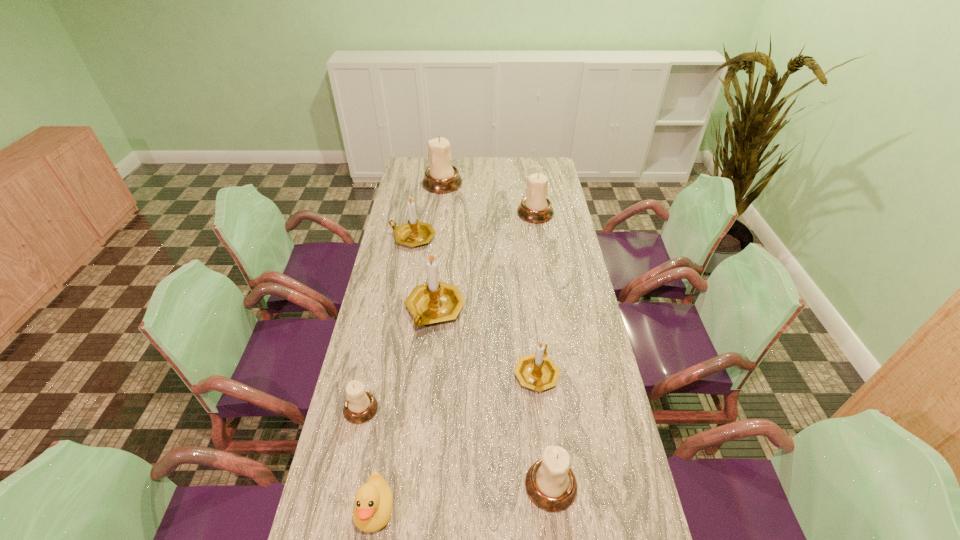
Locate an element on the screen. This screenshot has height=540, width=960. free space between the farthest gold candle holder and the shortest candle holder is located at coordinates (387, 323).

The image size is (960, 540). In order to click on empty space that is in between the fourth farthest object and the third nearest white candle holder in this screenshot , I will do `click(485, 261)`.

Locate an element on the screen. This screenshot has width=960, height=540. vacant space that is in between the third farthest white candle holder and the duck is located at coordinates (368, 458).

Locate an element on the screen. free spot between the duck and the seventh nearest object is located at coordinates (455, 361).

Identify which object is the third closest to the second nearest white candle holder. Please provide its 2D coordinates. Your answer should be formatted as a tuple, i.e. [(x, y)], where the tuple contains the x and y coordinates of a point satisfying the conditions above.

[(537, 371)]

Identify which object is located as the seventh nearest to the second biggest white candle holder. Please provide its 2D coordinates. Your answer should be formatted as a tuple, i.e. [(x, y)], where the tuple contains the x and y coordinates of a point satisfying the conditions above.

[(373, 502)]

Locate an element on the screen. This screenshot has height=540, width=960. candle holder that is the fourth closest one to the smallest gold candle holder is located at coordinates (414, 233).

Where is `the second closest candle holder to the shortest candle holder`? The image size is (960, 540). the second closest candle holder to the shortest candle holder is located at coordinates (537, 371).

The height and width of the screenshot is (540, 960). What are the coordinates of `white candle holder that is the second nearest to the sixth nearest candle holder` in the screenshot? It's located at tap(360, 406).

Locate which white candle holder ranks third in proximity to the second smallest white candle holder. Please provide its 2D coordinates. Your answer should be formatted as a tuple, i.e. [(x, y)], where the tuple contains the x and y coordinates of a point satisfying the conditions above.

[(441, 177)]